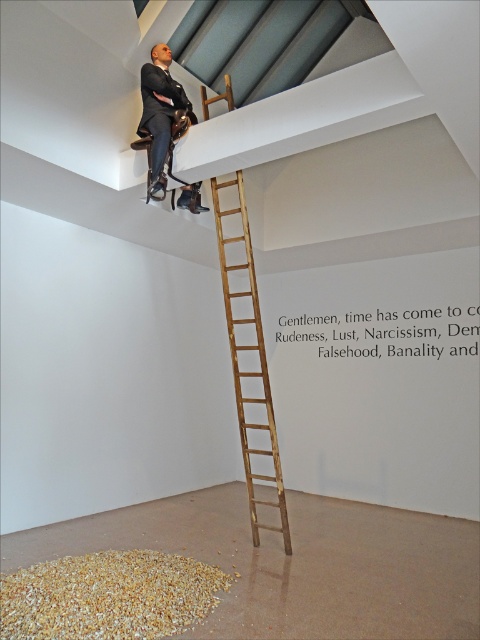
You are an art curator planning to install a new sculpture between the wooden ladder at upper center and the matte black suit at upper center. The sculpture requires a minimum of 4 feet of space. Can the available space accommodate this requirement?

The distance between the wooden ladder at upper center and the matte black suit at upper center is 4.10 feet, which exceeds the required 4 feet. Therefore, the sculpture can be accommodated in the available space.

You are an art curator planning to move the wooden ladder at upper center to the left wall to make space for a new sculpture. Given the ladder is currently at point 0.581, 0.523, will moving it to the left wall require moving it horizontally or vertically?

The wooden ladder at upper center is located at point (251,371). Moving it to the left wall would require moving it horizontally since the x coordinate 0.581 would need to decrease to reach the left side of the room.

You are an art curator planning to install a new sculpture in the gallery. The sculpture requires a stable surface at the lower left corner of the room. Can you confirm if the brown rough grain at lower left is positioned there?

The brown rough grain at lower left is located at point (108,596), which corresponds to the lower left corner of the room. Therefore, it is an appropriate stable surface for the sculpture.